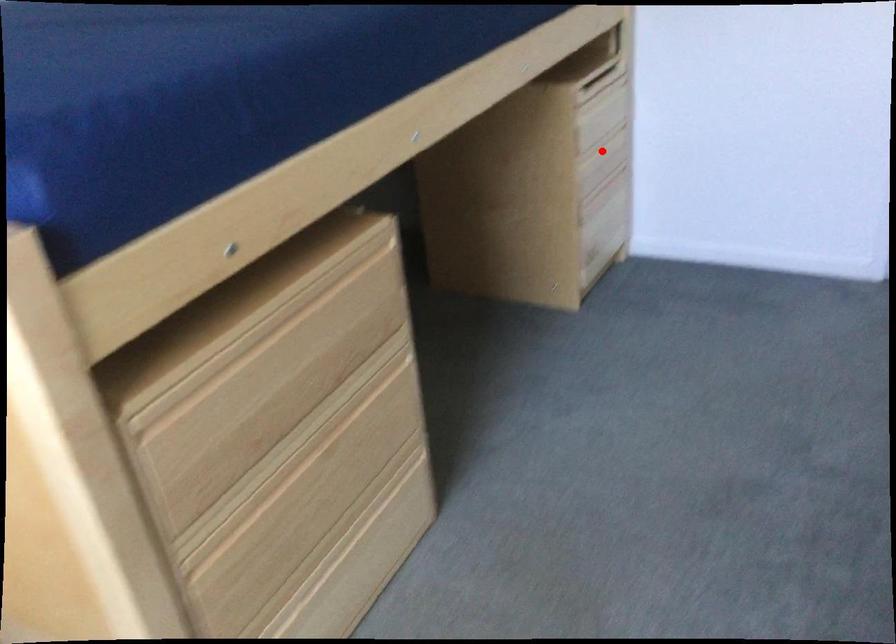
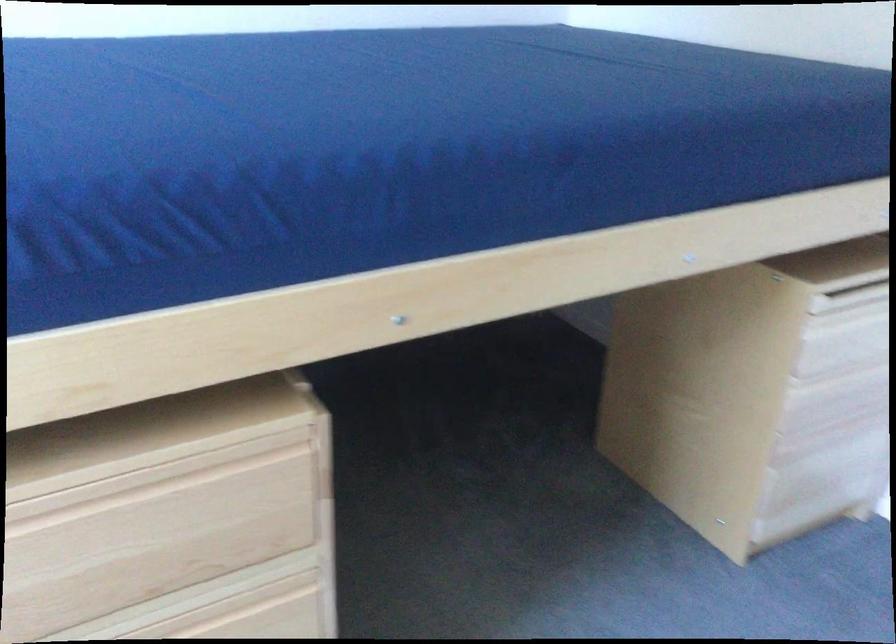
Question: I am providing you with two images of the same scene from different viewpoints. A red point is marked on the first image. Is the red point's position out of view in image 2?

Choices:
 (A) Yes
 (B) No

Answer: (B)